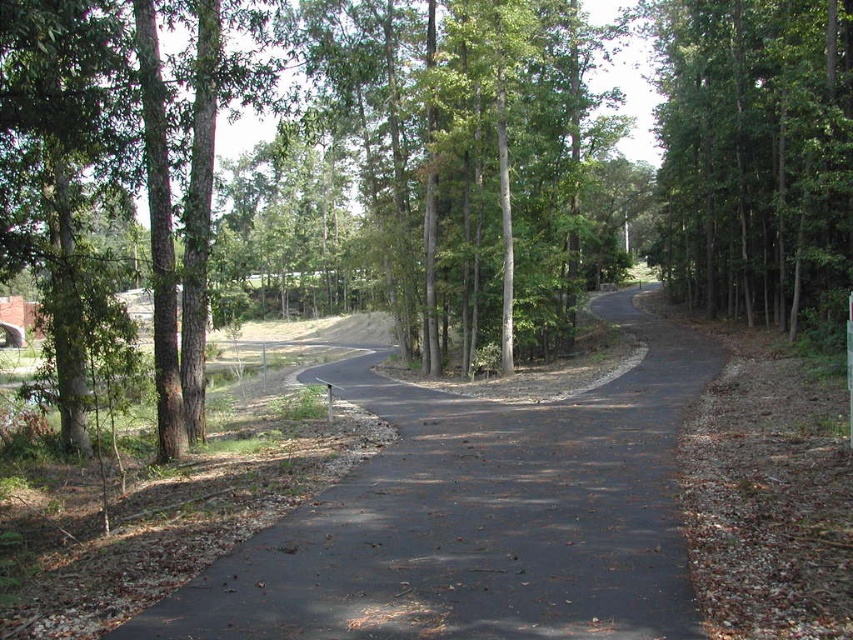
Can you confirm if black asphalt road at center is positioned below green leafy tree at right?

Yes, black asphalt road at center is below green leafy tree at right.

In the scene shown: Does black asphalt road at center appear over green leafy tree at right?

No.

Is point (618, 394) closer to camera compared to point (805, 116)?

Yes, point (618, 394) is closer to viewer.

You are a GUI agent. You are given a task and a screenshot of the screen. Output one action in this format:
    pyautogui.click(x=<x>, y=<y>)
    Task: Click on the black asphalt road at center
    
    Given the screenshot: What is the action you would take?
    pyautogui.click(x=479, y=516)